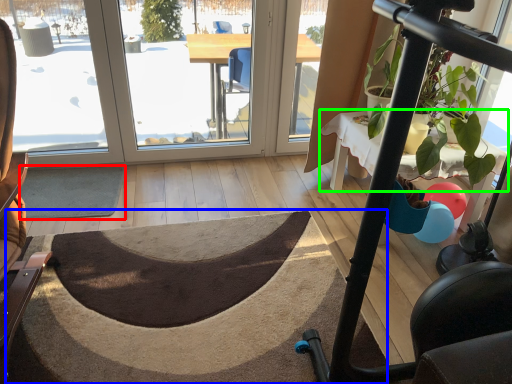
Question: Which object is the farthest from doormat (highlighted by a red box)? Choose among these: doormat (highlighted by a blue box) or table (highlighted by a green box).

Choices:
 (A) doormat
 (B) table

Answer: (B)